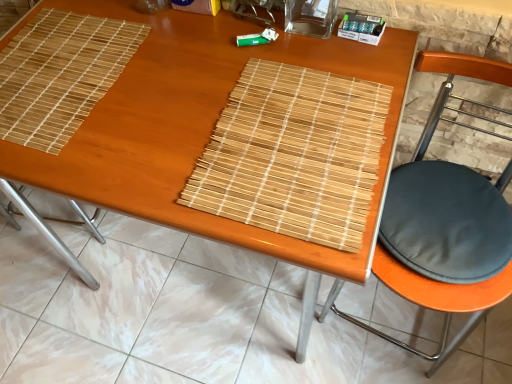
This screenshot has width=512, height=384. Identify the location of blank space to the left of natural bamboo mat at center, which ranks as the first mat in right-to-left order. (147, 137).